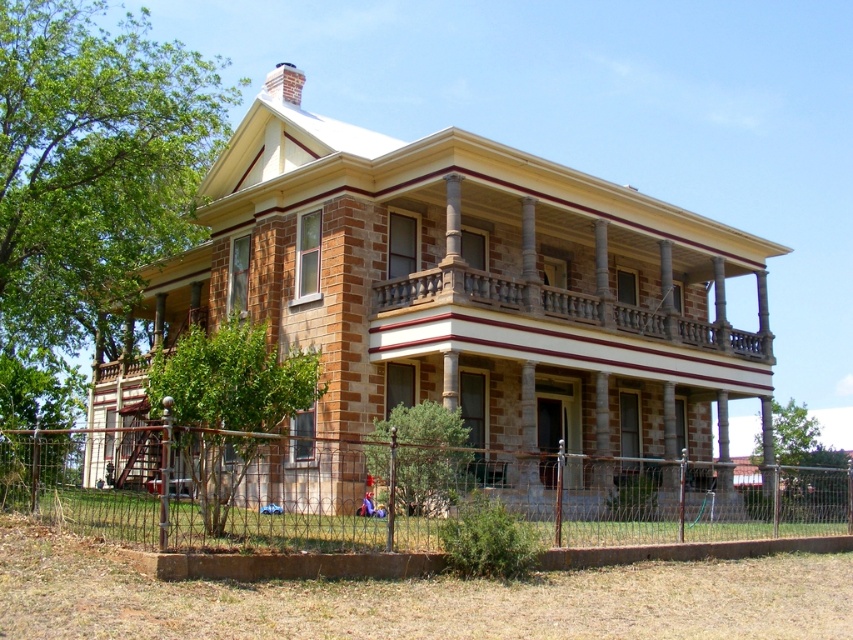
Which of these two, rusty metal fence at lower center or brown stone balcony at upper center, stands shorter?

brown stone balcony at upper center is shorter.

Does rusty metal fence at lower center appear under brown stone balcony at upper center?

Yes, rusty metal fence at lower center is below brown stone balcony at upper center.

The width and height of the screenshot is (853, 640). In order to click on rusty metal fence at lower center in this screenshot , I will do `click(389, 492)`.